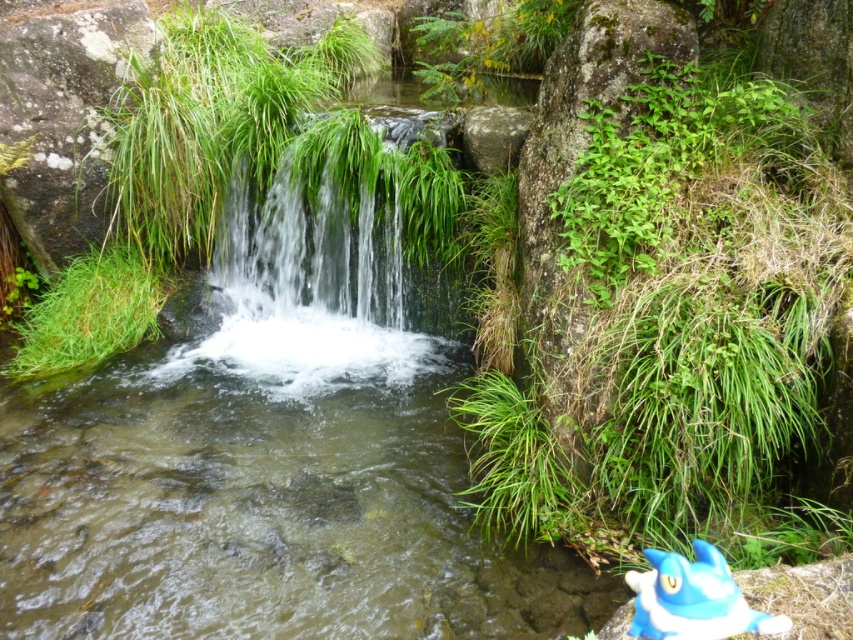
Question: Can you confirm if clear water cascade at center is positioned below blue plush toy at lower right?

Choices:
 (A) no
 (B) yes

Answer: (A)

Question: Can you confirm if clear water cascade at center is smaller than blue plush toy at lower right?

Choices:
 (A) yes
 (B) no

Answer: (B)

Question: Which of the following is the closest to the observer?

Choices:
 (A) blue plush toy at lower right
 (B) clear water cascade at center

Answer: (A)

Question: Among these points, which one is farthest from the camera?

Choices:
 (A) (241, 253)
 (B) (664, 584)

Answer: (A)

Question: Can you confirm if clear water cascade at center is wider than blue plush toy at lower right?

Choices:
 (A) yes
 (B) no

Answer: (A)